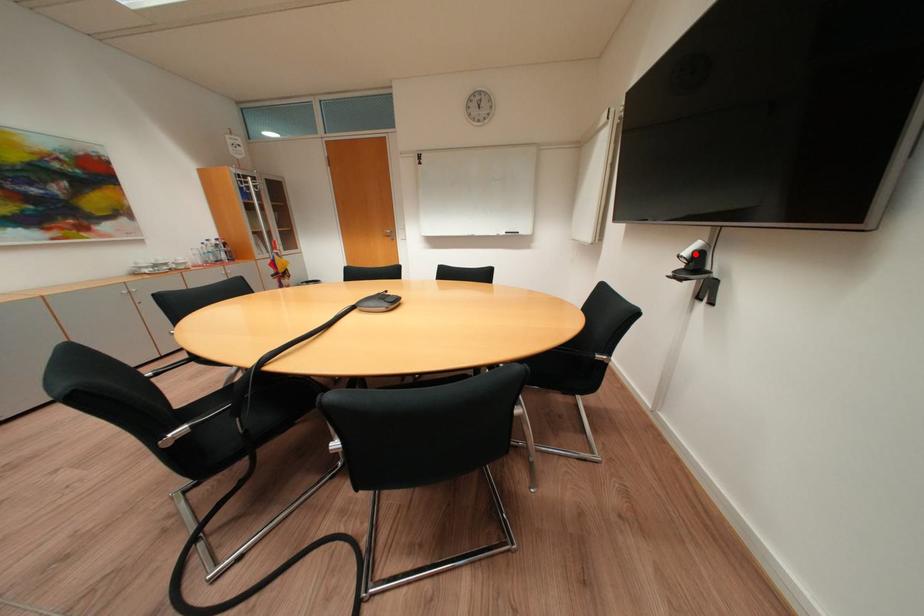
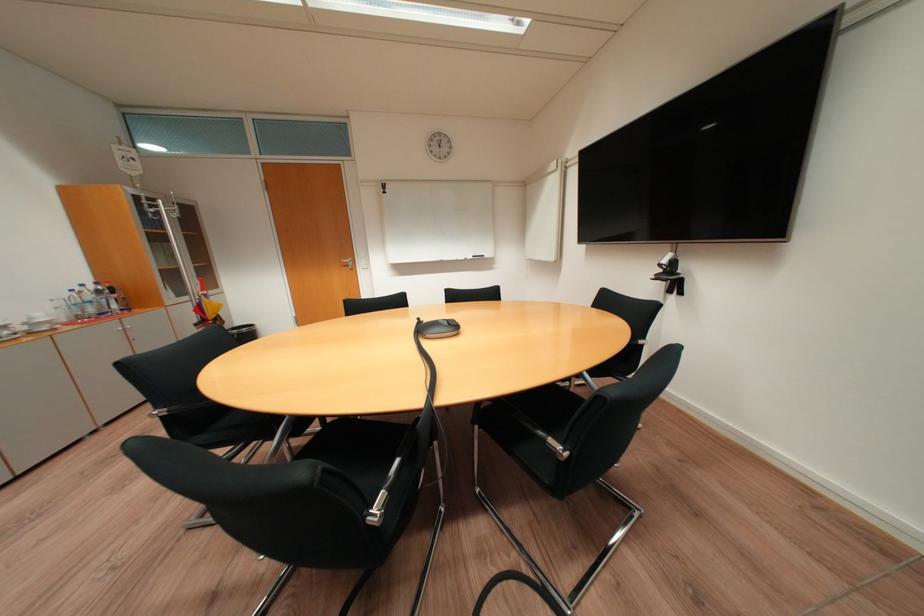
The point at the highlighted location is marked in the first image. Where is the corresponding point in the second image?

(673, 262)